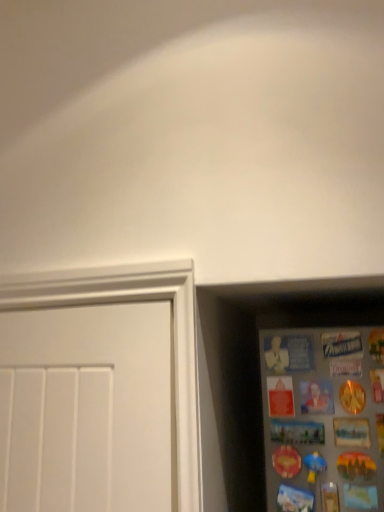
Question: Should I look upward or downward to see metallic silver magnets at right?

Choices:
 (A) down
 (B) up

Answer: (A)